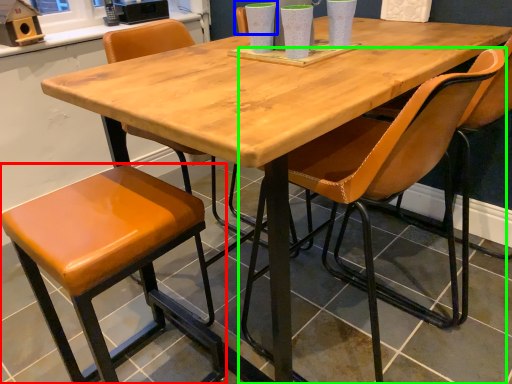
Question: Which object is positioned farthest from stool (highlighted by a red box)? Select from chair (highlighted by a blue box) and chair (highlighted by a green box).

Choices:
 (A) chair
 (B) chair

Answer: (A)